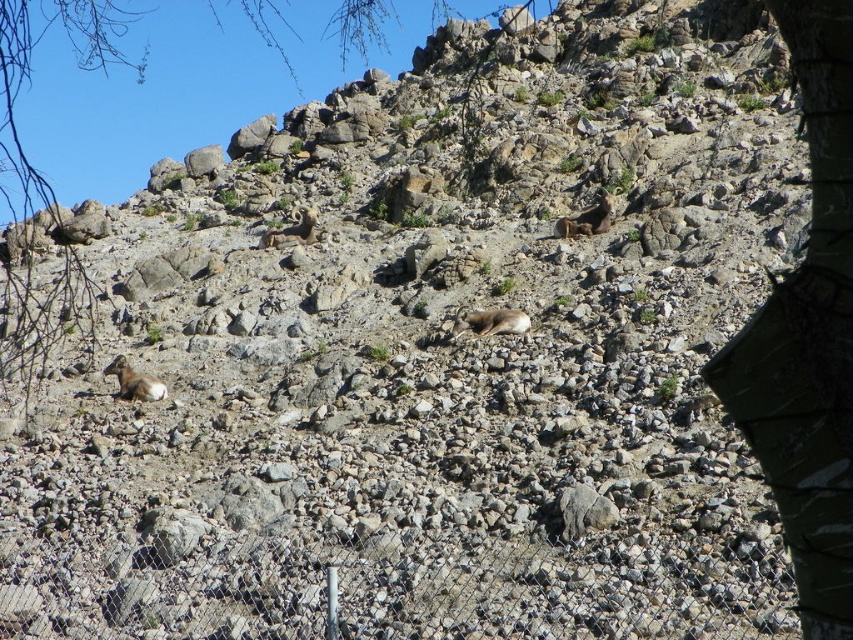
Question: Which is farther from the white woolly goat at lower left?

Choices:
 (A) green leafy tree at upper center
 (B) brown woolly sheep at upper center
 (C) white woolly sheep at center
 (D) green camouflage tree at right

Answer: (A)

Question: Which point is closer to the camera?

Choices:
 (A) (303, 236)
 (B) (3, 168)

Answer: (A)

Question: Which object is positioned farthest from the white woolly goat at lower left?

Choices:
 (A) green leafy tree at upper center
 (B) brown woolly sheep at upper center
 (C) brown fur at center
 (D) green camouflage tree at right

Answer: (A)

Question: Is white woolly sheep at center further to the viewer compared to brown fur at center?

Choices:
 (A) yes
 (B) no

Answer: (B)

Question: Can you confirm if white woolly goat at lower left is positioned below brown woolly sheep at upper center?

Choices:
 (A) no
 (B) yes

Answer: (B)

Question: Considering the relative positions of green camouflage tree at right and brown fur at center in the image provided, where is green camouflage tree at right located with respect to brown fur at center?

Choices:
 (A) right
 (B) left

Answer: (B)